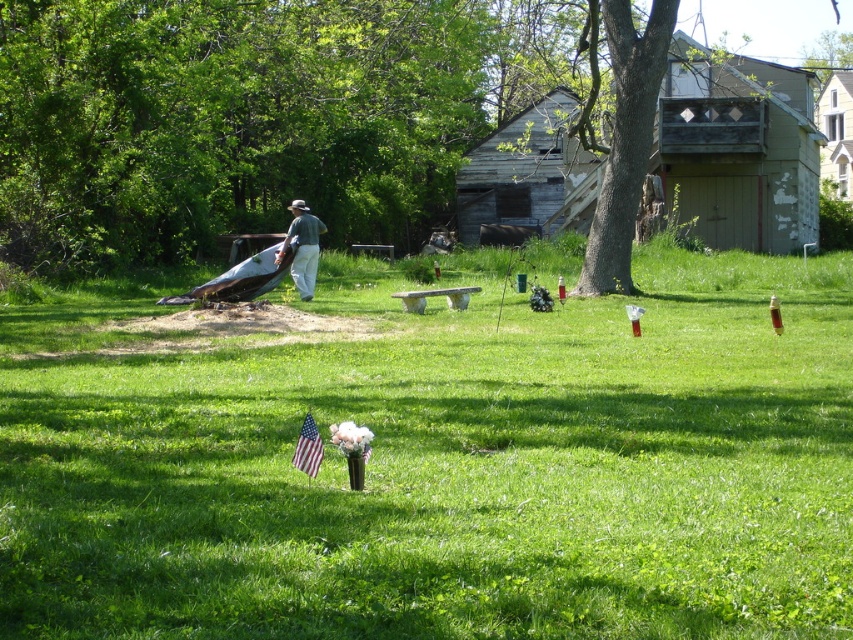
Based on the photo, you are a photographer trying to capture the entire scene in one shot. Given that the green leafy tree at upper left and the american flag at center are both in your frame, which object will appear taller in the photo?

The green leafy tree at upper left will appear taller in the photo because it has a greater height compared to the american flag at center.

You are standing at the point closest to the viewer in the scene. You want to walk towards the large rusted machinery object. Which point, point (315, 35) or point (306, 429), is closer to your starting position?

Point (306, 429) is closer to your starting position because you are at the point closest to the viewer, which is point (306, 429). Since point (315, 35) is behind point (306, 429), the closer point to your starting position is point (306, 429).